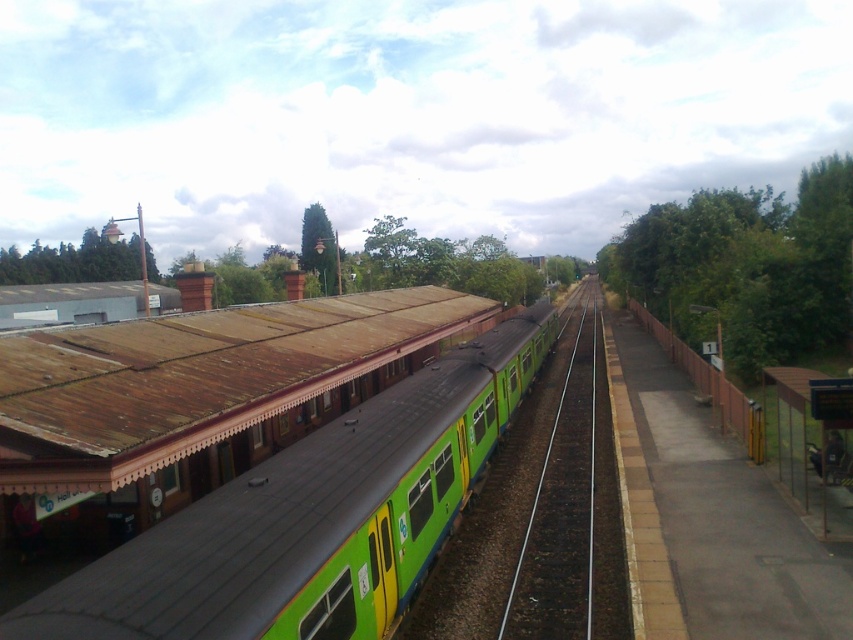
You are standing on the platform at the railway station and see the green matte train at center and the green rubber train track at center. Which object is closer to you?

The green matte train at center is closer to the viewer than the green rubber train track at center.

Consider the image. You are a maintenance worker who needs to walk from the green matte train at center to the green rubber train track at center to inspect them both. Given that your tool kit is 3.5 meters long, can you carry it horizontally without needing to move it while walking between them?

The distance between the green matte train at center and the green rubber train track at center is 4.01 meters. Since your tool kit is 3.5 meters long, you can carry it horizontally as the distance between them is greater than the tool kit length.

You are a maintenance worker tasked with checking the train and track. You need to determine if the train can fit on the track. Based on the scene, can the green matte train at center fit on the green rubber train track at center?

The green matte train at center has a larger size compared to green rubber train track at center, so it cannot fit on the track.